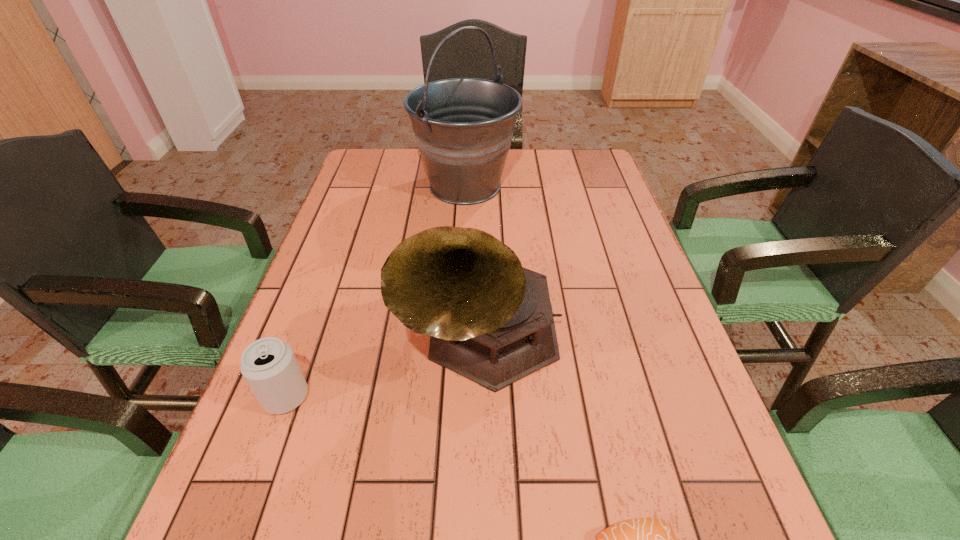
This screenshot has height=540, width=960. I want to click on the tallest object, so click(x=463, y=127).

You are a GUI agent. You are given a task and a screenshot of the screen. Output one action in this format:
    pyautogui.click(x=<x>, y=<y>)
    Task: Click on the bucket
    
    Given the screenshot: What is the action you would take?
    pyautogui.click(x=463, y=127)

This screenshot has height=540, width=960. What are the coordinates of `the second tallest object` in the screenshot? It's located at 489,319.

This screenshot has width=960, height=540. I want to click on the third tallest object, so click(269, 366).

This screenshot has height=540, width=960. I want to click on can, so click(269, 366).

At what (x,y) coordinates should I click in order to perform the action: click on vacant space situated 0.210m on the left of the tallest object. Please return your answer as a coordinate pair (x, y). Looking at the image, I should click on click(x=347, y=186).

Locate an element on the screen. Image resolution: width=960 pixels, height=540 pixels. vacant region located on the horn direction of the phonograph record is located at coordinates (483, 453).

This screenshot has width=960, height=540. Find the location of `vacant space situated on the right of the can`. vacant space situated on the right of the can is located at coordinates 414,397.

At what (x,y) coordinates should I click in order to perform the action: click on object positioned at the far edge. Please return your answer as a coordinate pair (x, y). Looking at the image, I should click on (463, 127).

Where is `object present at the left edge`? object present at the left edge is located at coordinates (269, 366).